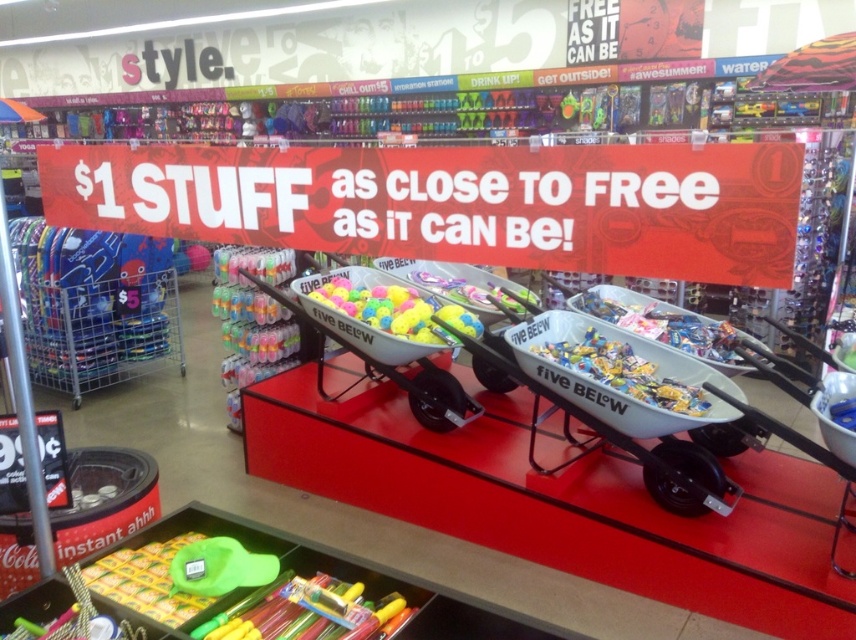
Question: Can you confirm if white plastic wheelbarrow at center is smaller than matte plastic balls at center?

Choices:
 (A) no
 (B) yes

Answer: (A)

Question: Is the position of white plastic wheelbarrow at center less distant than that of matte plastic balls at center?

Choices:
 (A) no
 (B) yes

Answer: (A)

Question: Which of the following is the closest to the observer?

Choices:
 (A) matte plastic balls at center
 (B) white plastic wheelbarrow at center

Answer: (A)

Question: Which object is farther from the camera taking this photo?

Choices:
 (A) white plastic wheelbarrow at center
 (B) matte plastic balls at center

Answer: (A)

Question: Among these objects, which one is farthest from the camera?

Choices:
 (A) white plastic wheelbarrow at center
 (B) matte plastic balls at center

Answer: (A)

Question: Is white plastic wheelbarrow at center further to the viewer compared to matte plastic balls at center?

Choices:
 (A) no
 (B) yes

Answer: (B)